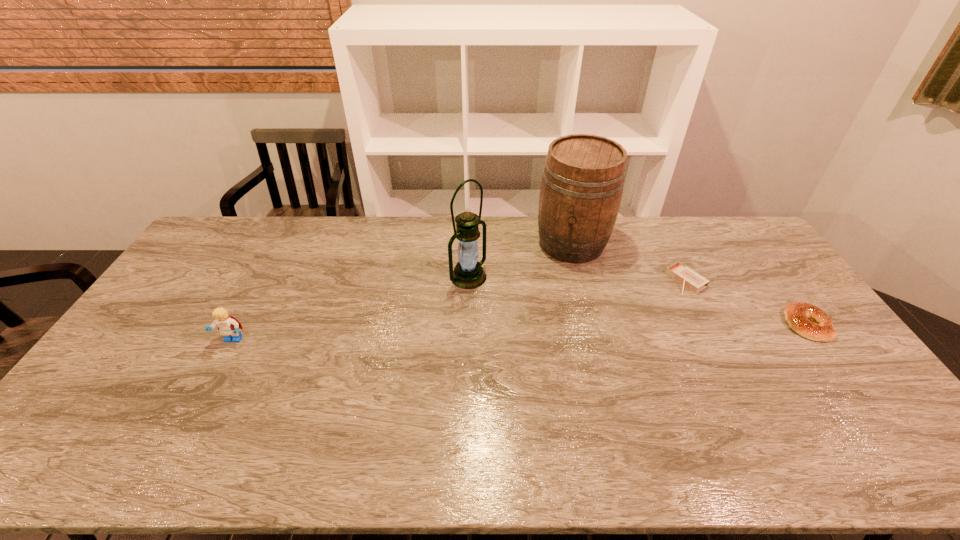
Locate an element on the screen. The image size is (960, 540). free point between the second object from left to right and the rightmost object is located at coordinates (637, 301).

The image size is (960, 540). In order to click on empty space between the second object from right to left and the rightmost object in this screenshot , I will do `click(746, 302)`.

You are a GUI agent. You are given a task and a screenshot of the screen. Output one action in this format:
    pyautogui.click(x=<x>, y=<y>)
    Task: Click on the closest object relative to the third shortest object
    The image size is (960, 540).
    Given the screenshot: What is the action you would take?
    pyautogui.click(x=468, y=273)

Identify the location of object that is the third closest to the second object from right to left. (468, 273).